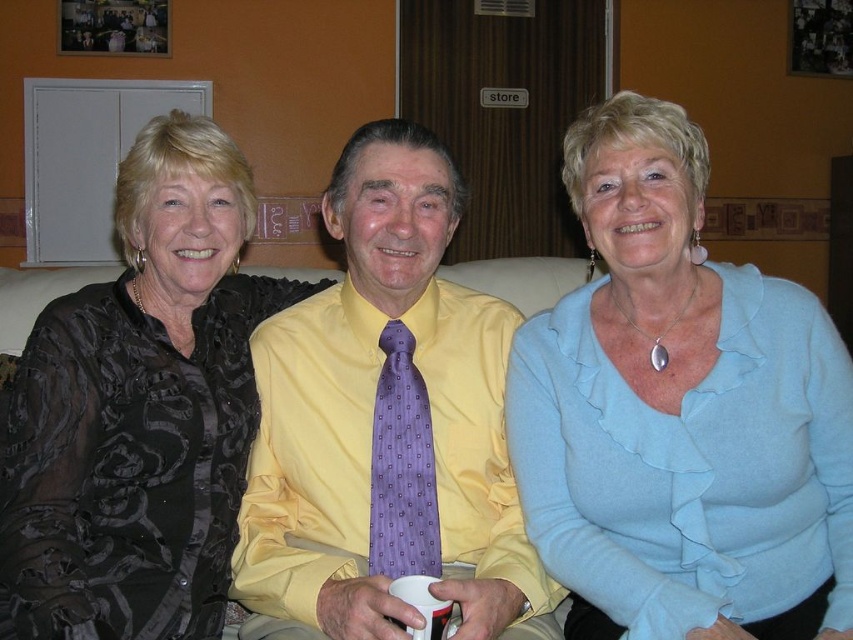
Question: Among these objects, which one is nearest to the camera?

Choices:
 (A) light blue fabric at center
 (B) black satin blouse at left
 (C) purple silk tie at center
 (D) yellow satin shirt at center

Answer: (D)

Question: Among these objects, which one is nearest to the camera?

Choices:
 (A) black satin blouse at left
 (B) yellow satin shirt at center
 (C) purple silk tie at center

Answer: (B)

Question: Is yellow satin shirt at center smaller than purple silk tie at center?

Choices:
 (A) yes
 (B) no

Answer: (B)

Question: Does light blue fabric at center have a lesser width compared to yellow satin shirt at center?

Choices:
 (A) yes
 (B) no

Answer: (A)

Question: Is yellow satin shirt at center below black satin blouse at left?

Choices:
 (A) no
 (B) yes

Answer: (A)

Question: Which of the following is the closest to the observer?

Choices:
 (A) black satin blouse at left
 (B) purple silk tie at center
 (C) light blue fabric at center

Answer: (A)